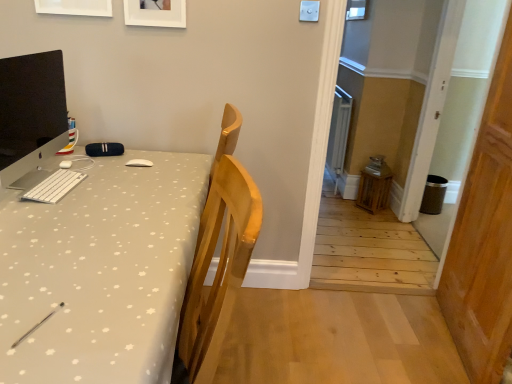
Question: Is white fabric desk at left looking in the opposite direction of white matte keyboard at left?

Choices:
 (A) no
 (B) yes

Answer: (A)

Question: Does white fabric desk at left have a lesser width compared to white matte keyboard at left?

Choices:
 (A) no
 (B) yes

Answer: (A)

Question: Is white fabric desk at left further to camera compared to white matte keyboard at left?

Choices:
 (A) no
 (B) yes

Answer: (A)

Question: Is white fabric desk at left completely or partially outside of white matte keyboard at left?

Choices:
 (A) no
 (B) yes

Answer: (B)

Question: Is white matte keyboard at left a part of white fabric desk at left?

Choices:
 (A) yes
 (B) no

Answer: (A)

Question: From their relative heights in the image, would you say matte black monitor at left is taller or shorter than wooden door at right?

Choices:
 (A) tall
 (B) short

Answer: (B)

Question: In terms of size, does matte black monitor at left appear bigger or smaller than wooden door at right?

Choices:
 (A) small
 (B) big

Answer: (A)

Question: Relative to wooden door at right, is matte black monitor at left in front or behind?

Choices:
 (A) behind
 (B) front

Answer: (A)

Question: Is matte black monitor at left situated inside wooden door at right or outside?

Choices:
 (A) inside
 (B) outside

Answer: (B)

Question: Do you think white matte picture frame at upper center, arranged as the second picture frame when viewed from the right, is within wooden door at right, or outside of it?

Choices:
 (A) outside
 (B) inside

Answer: (A)

Question: From a real-world perspective, is white matte picture frame at upper center, arranged as the second picture frame when viewed from the right, positioned above or below wooden door at right?

Choices:
 (A) below
 (B) above

Answer: (B)

Question: Is white matte picture frame at upper center, arranged as the second picture frame when viewed from the right, wider or thinner than wooden door at right?

Choices:
 (A) wide
 (B) thin

Answer: (B)

Question: Considering their positions, is white matte picture frame at upper center, the first picture frame from the left, located in front of or behind wooden door at right?

Choices:
 (A) behind
 (B) front

Answer: (A)

Question: Choose the correct answer: Is white matte picture frame at upper center, arranged as the second picture frame when viewed from the right, inside white matte keyboard at left or outside it?

Choices:
 (A) inside
 (B) outside

Answer: (B)

Question: Relative to white matte keyboard at left, is white matte picture frame at upper center, the first picture frame from the left, in front or behind?

Choices:
 (A) behind
 (B) front

Answer: (A)